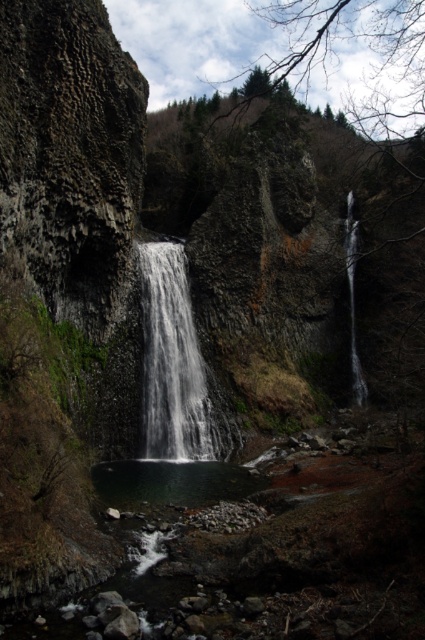
Can you confirm if white textured waterfall at center is shorter than clear water at center?

Indeed, white textured waterfall at center has a lesser height compared to clear water at center.

Find the location of `white textured waterfall at center`. white textured waterfall at center is located at coordinates (172, 362).

Where is `white textured waterfall at center`? The width and height of the screenshot is (425, 640). white textured waterfall at center is located at coordinates (172, 362).